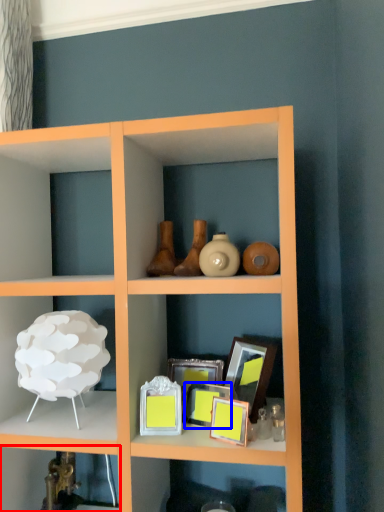
Question: Which point is closer to the camera, shelf (highlighted by a red box) or picture frame (highlighted by a blue box)?

Choices:
 (A) shelf
 (B) picture frame

Answer: (B)